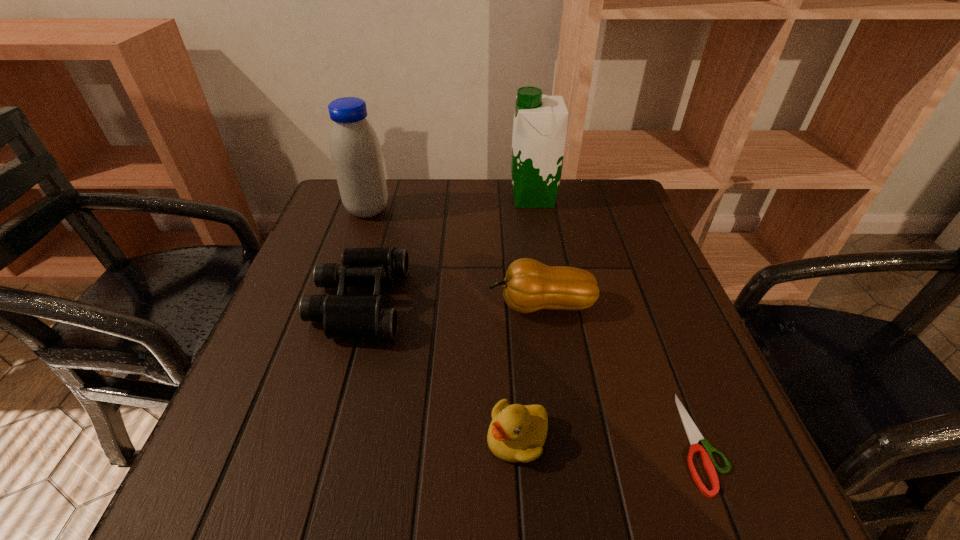
The width and height of the screenshot is (960, 540). I want to click on the right soya milk, so click(x=540, y=123).

Where is `the left soya milk`? the left soya milk is located at coordinates (356, 154).

Image resolution: width=960 pixels, height=540 pixels. I want to click on gourd, so click(529, 285).

The height and width of the screenshot is (540, 960). I want to click on binoculars, so click(x=352, y=317).

Where is `duckling`? The image size is (960, 540). duckling is located at coordinates (517, 433).

The height and width of the screenshot is (540, 960). Identify the location of scissors. (694, 436).

Locate an element on the screen. This screenshot has height=540, width=960. the rightmost object is located at coordinates (694, 436).

Locate an element on the screen. The width and height of the screenshot is (960, 540). vacant region located on the front-facing side of the right soya milk is located at coordinates (444, 198).

Identify the location of vacant space located on the front-facing side of the right soya milk. This screenshot has height=540, width=960. (488, 198).

You are a GUI agent. You are given a task and a screenshot of the screen. Output one action in this format:
    pyautogui.click(x=<x>, y=<y>)
    Task: Click on the free space located 0.140m on the front-facing side of the right soya milk
    Image resolution: width=960 pixels, height=540 pixels.
    Given the screenshot: What is the action you would take?
    pyautogui.click(x=458, y=198)